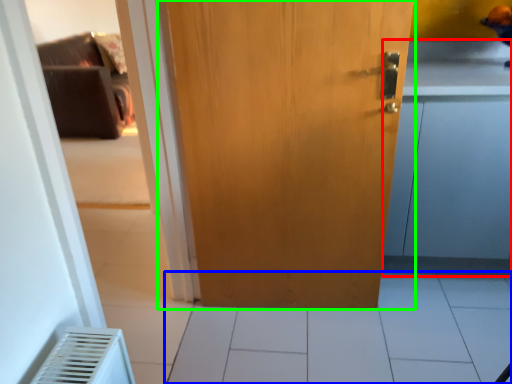
Question: Estimate the real-world distances between objects in this image. Which object is farther from cabinetry (highlighted by a red box), tile (highlighted by a blue box) or door (highlighted by a green box)?

Choices:
 (A) tile
 (B) door

Answer: (A)